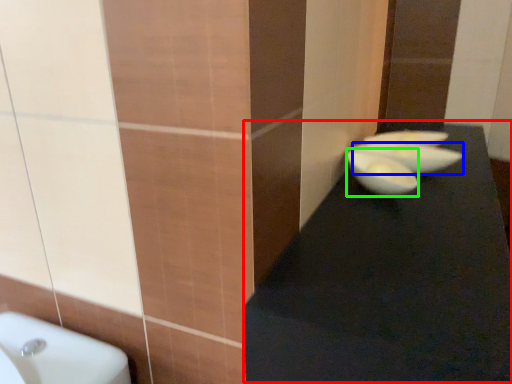
Question: Which object is the closest to the table top (highlighted by a red box)? Choose among these: basin (highlighted by a blue box) or glass bowl (highlighted by a green box).

Choices:
 (A) basin
 (B) glass bowl

Answer: (B)